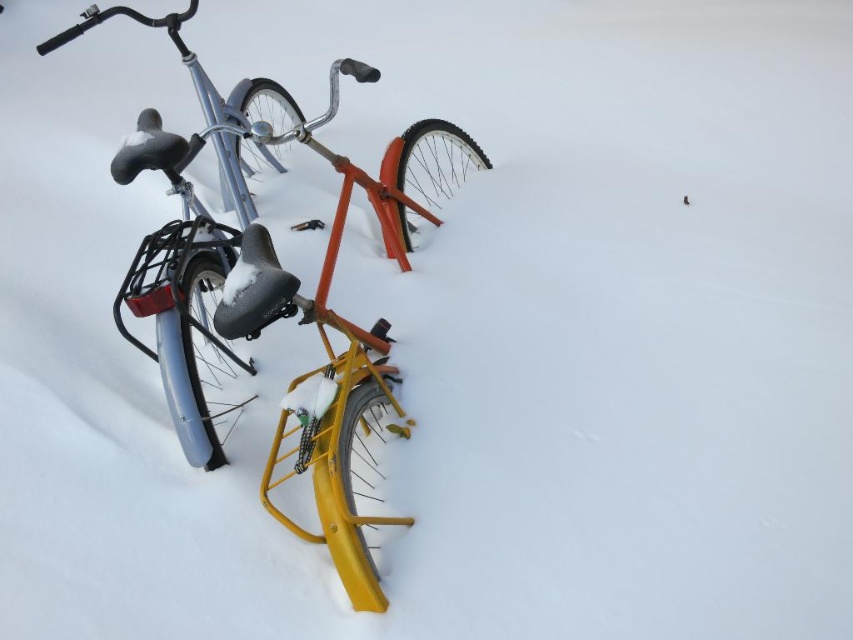
You are a delivery person who needs to choose a bicycle to ride through the snowy path. The yellow matte bicycle at center and the matte blue bicycle at left are both available. Which bicycle should you choose to ensure visibility and safety in the snow?

The yellow matte bicycle at center is more visible against the snow, so you should choose the yellow matte bicycle at center for better visibility and safety.

You are standing in a snowy parking lot and see the yellow matte bicycle at center and the matte blue bicycle at left. Which bicycle is positioned to the right side from your viewpoint?

The yellow matte bicycle at center is positioned to the right of the matte blue bicycle at left, so the yellow matte bicycle at center is on the right side.

You are standing at the point marked by coordinates point (x=329, y=342) in the image. Looking around, you see the silver bicycle on the left and the orange bicycle with yellow fenders on the right. Which bicycle is closer to your current position?

The point (x=329, y=342) indicates yellow matte bicycle at center, so you are standing at the yellow matte bicycle at center. Therefore, the orange bicycle with yellow fenders on the right is the same as the yellow matte bicycle at center, meaning it is your current position. The silver bicycle on the left is farther away from your current position.